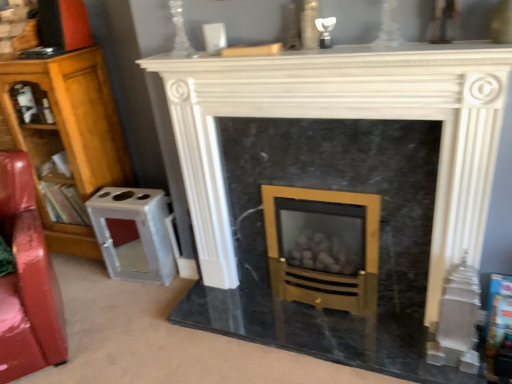
Where is `free region on the left part of white marble fireplace at center`? Image resolution: width=512 pixels, height=384 pixels. free region on the left part of white marble fireplace at center is located at coordinates (200, 326).